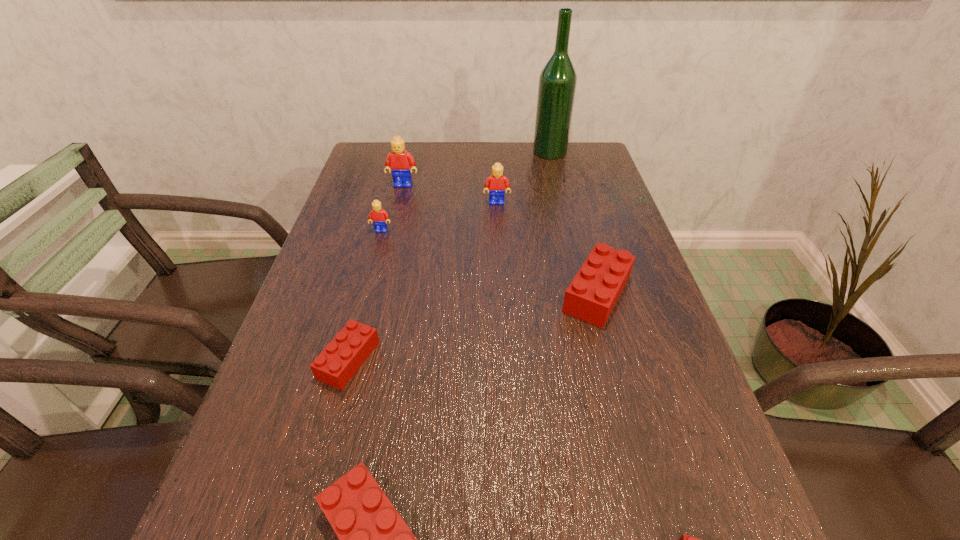
At what (x,y) coordinates should I click in order to perform the action: click on the third nearest Lego. Please return your answer as a coordinate pair (x, y). Image resolution: width=960 pixels, height=540 pixels. Looking at the image, I should click on (340, 360).

Locate an element on the screen. the second farthest red Lego is located at coordinates (340, 360).

Where is `free space located on the left of the tallest object`? free space located on the left of the tallest object is located at coordinates (417, 152).

This screenshot has width=960, height=540. What are the coordinates of `blank area located on the front-facing side of the farthest Lego` in the screenshot? It's located at (380, 285).

In order to click on vacant area situated on the front-facing side of the fifth object from left to right in this screenshot , I will do `click(498, 240)`.

The height and width of the screenshot is (540, 960). What are the coordinates of `vacant space located 0.090m on the front-facing side of the nearest yellow Lego` in the screenshot? It's located at (374, 256).

Image resolution: width=960 pixels, height=540 pixels. In order to click on vacant space situated on the back of the fourth nearest Lego in this screenshot , I will do `click(569, 190)`.

Image resolution: width=960 pixels, height=540 pixels. I want to click on vacant space located on the back of the second shortest Lego, so click(366, 294).

The height and width of the screenshot is (540, 960). Find the location of `object situated at the far edge`. object situated at the far edge is located at coordinates (557, 84).

Image resolution: width=960 pixels, height=540 pixels. I want to click on alcohol at the right edge, so click(557, 84).